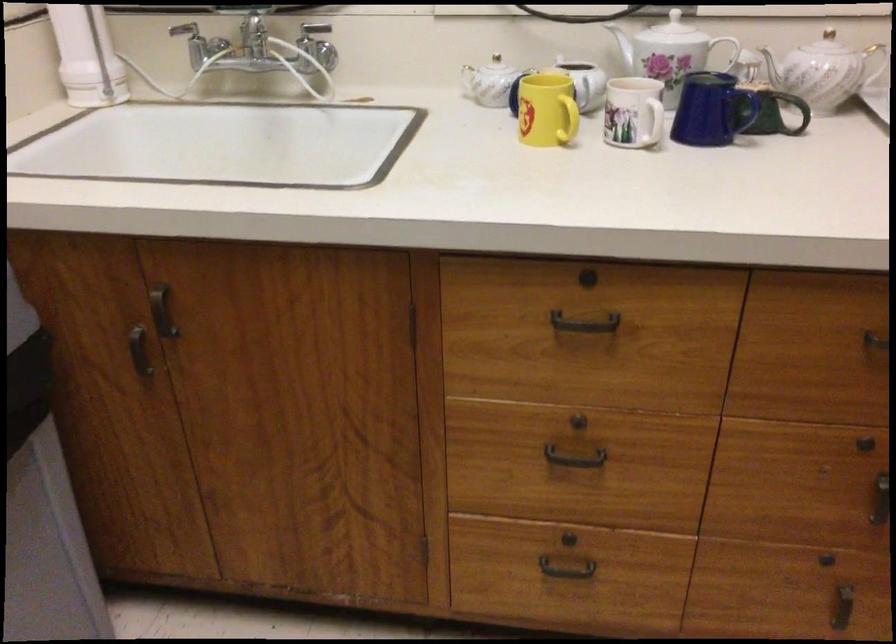
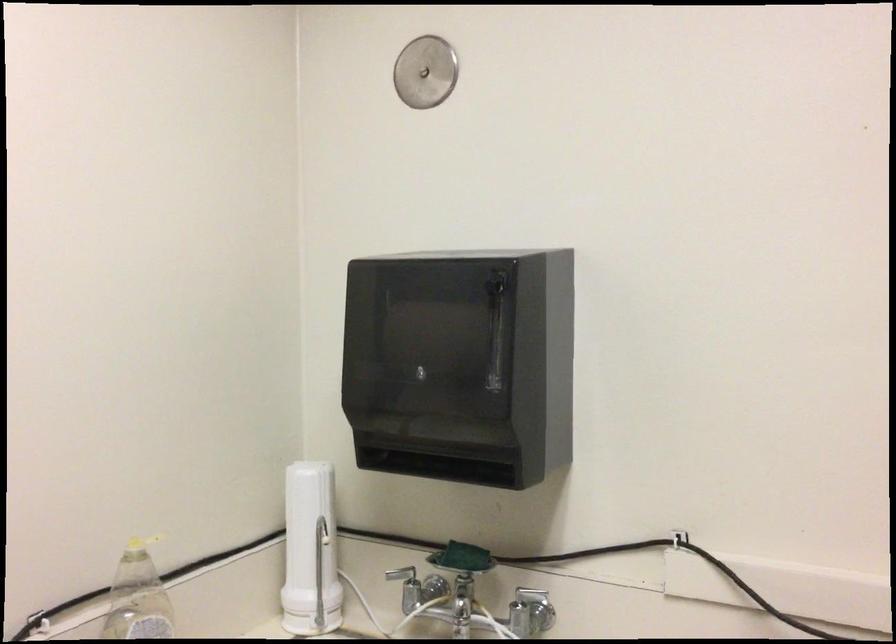
The point at (278,75) is marked in the first image. Where is the corresponding point in the second image?

(490, 621)